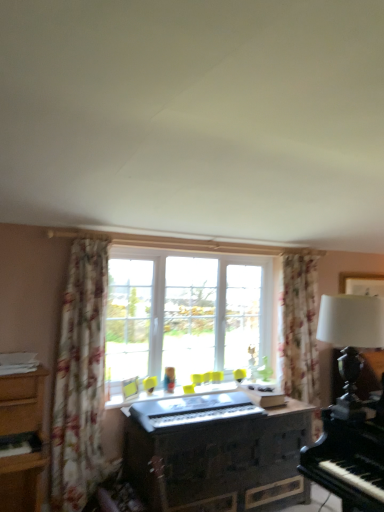
Question: Can you confirm if white matte table lamp at right is taller than floral fabric curtain at left?

Choices:
 (A) no
 (B) yes

Answer: (A)

Question: Does white matte table lamp at right turn towards floral fabric curtain at left?

Choices:
 (A) no
 (B) yes

Answer: (A)

Question: From the image's perspective, is white matte table lamp at right located beneath floral fabric curtain at left?

Choices:
 (A) no
 (B) yes

Answer: (A)

Question: Is white matte table lamp at right wider than floral fabric curtain at left?

Choices:
 (A) no
 (B) yes

Answer: (B)

Question: Is white matte table lamp at right turned away from floral fabric curtain at left?

Choices:
 (A) yes
 (B) no

Answer: (B)

Question: Is floral fabric curtain at left inside or outside of metallic silver keyboard at center?

Choices:
 (A) inside
 (B) outside

Answer: (B)

Question: From a real-world perspective, relative to metallic silver keyboard at center, is floral fabric curtain at left vertically above or below?

Choices:
 (A) above
 (B) below

Answer: (A)

Question: Considering the positions of floral fabric curtain at left and metallic silver keyboard at center in the image, is floral fabric curtain at left bigger or smaller than metallic silver keyboard at center?

Choices:
 (A) small
 (B) big

Answer: (B)

Question: Is floral fabric curtain at left wider or thinner than metallic silver keyboard at center?

Choices:
 (A) thin
 (B) wide

Answer: (A)

Question: In terms of height, does wooden dresser at center look taller or shorter compared to white matte table lamp at right?

Choices:
 (A) tall
 (B) short

Answer: (A)

Question: Is point (256, 416) closer or farther from the camera than point (339, 310)?

Choices:
 (A) farther
 (B) closer

Answer: (A)

Question: From the image's perspective, relative to white matte table lamp at right, is wooden dresser at center above or below?

Choices:
 (A) above
 (B) below

Answer: (B)

Question: Looking at the image, does wooden dresser at center seem bigger or smaller compared to white matte table lamp at right?

Choices:
 (A) small
 (B) big

Answer: (B)

Question: Based on their sizes in the image, would you say clear glass window at center is bigger or smaller than wooden dresser at center?

Choices:
 (A) small
 (B) big

Answer: (A)

Question: From a real-world perspective, is clear glass window at center above or below wooden dresser at center?

Choices:
 (A) above
 (B) below

Answer: (A)